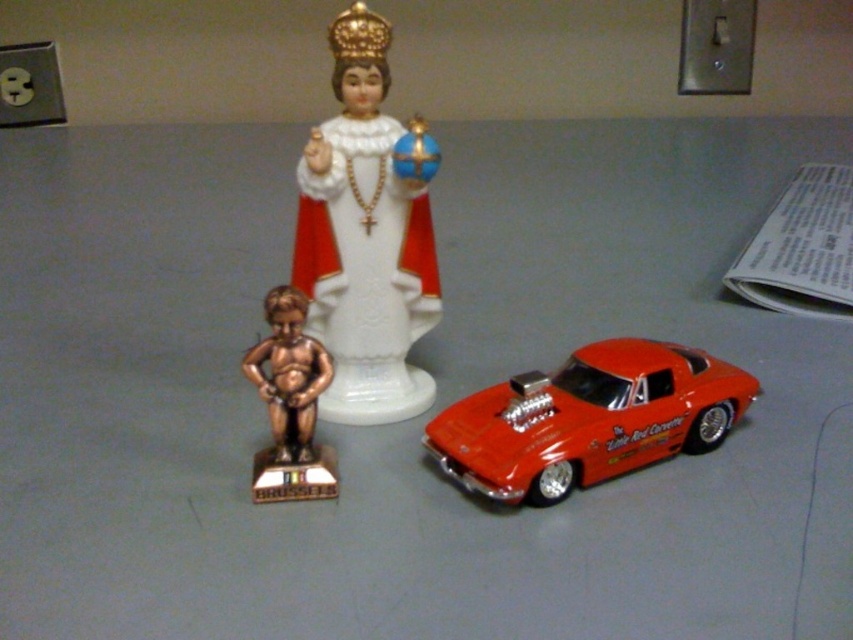
You are standing at the edge of the table where the three objects are placed. You want to pick up the object that is closer to you. Which object should you choose between point (514, 451) and point (306, 417)?

You should choose point (514, 451) because it is closer to you than point (306, 417).

You are a delivery person who needs to place a new shiny red car at center on the table without moving the existing white porcelain statue at center. Is this possible?

The white porcelain statue at center is positioned over the shiny red car at center, so the statue is already placed on top of the car. Therefore, you cannot place the new shiny red car at center without moving the existing statue.